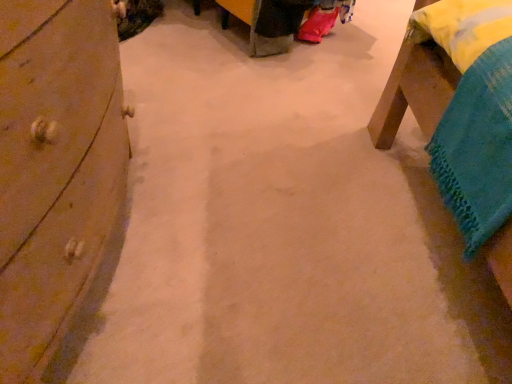
Describe the element at coordinates (413, 92) in the screenshot. I see `wooden bed frame at upper right` at that location.

I want to click on wooden bed frame at upper right, so click(x=413, y=92).

Image resolution: width=512 pixels, height=384 pixels. Describe the element at coordinates (55, 168) in the screenshot. I see `wooden dresser at left` at that location.

I want to click on wooden dresser at left, so [55, 168].

In order to face wooden dresser at left, should I rotate leftwards or rightwards?

Rotate your view left by about 32.052°.

Find the location of `wooden bed frame at upper right`. wooden bed frame at upper right is located at coordinates (413, 92).

Based on the photo, does wooden bed frame at upper right appear on the right side of wooden dresser at left?

Correct, you'll find wooden bed frame at upper right to the right of wooden dresser at left.

Relative to wooden dresser at left, is wooden bed frame at upper right in front or behind?

Visually, wooden bed frame at upper right is located behind wooden dresser at left.

Is point (433, 95) positioned in front of point (92, 172)?

No, (433, 95) is further to viewer.

From the image's perspective, is wooden bed frame at upper right over wooden dresser at left?

Indeed, from the image's perspective, wooden bed frame at upper right is shown above wooden dresser at left.

From a real-world perspective, which is physically above, wooden bed frame at upper right or wooden dresser at left?

In real-world perspective, wooden dresser at left is above.

Consider the image. Considering the sizes of objects wooden bed frame at upper right and wooden dresser at left in the image provided, who is thinner, wooden bed frame at upper right or wooden dresser at left?

With smaller width is wooden bed frame at upper right.

From their relative heights in the image, would you say wooden bed frame at upper right is taller or shorter than wooden dresser at left?

Considering their sizes, wooden bed frame at upper right has less height than wooden dresser at left.

In terms of size, does wooden bed frame at upper right appear bigger or smaller than wooden dresser at left?

Considering their sizes, wooden bed frame at upper right takes up less space than wooden dresser at left.

Choose the correct answer: Is wooden bed frame at upper right inside wooden dresser at left or outside it?

wooden bed frame at upper right is located beyond the bounds of wooden dresser at left.

Can you see wooden bed frame at upper right touching wooden dresser at left?

wooden bed frame at upper right is not next to wooden dresser at left, and they're not touching.

Is wooden bed frame at upper right turned away from wooden dresser at left?

That's not correct — wooden bed frame at upper right is not looking away from wooden dresser at left.

How different are the orientations of wooden bed frame at upper right and wooden dresser at left in degrees?

The angle between the facing direction of wooden bed frame at upper right and the facing direction of wooden dresser at left is 90.2 degrees.

How much distance is there between wooden bed frame at upper right and wooden dresser at left?

They are 36.64 inches apart.

Where is `chest of drawers in front of the wooden bed frame at upper right`? This screenshot has height=384, width=512. chest of drawers in front of the wooden bed frame at upper right is located at coordinates (55, 168).

Between wooden dresser at left and wooden bed frame at upper right, which one appears on the right side from the viewer's perspective?

Positioned to the right is wooden bed frame at upper right.

Is wooden dresser at left positioned in front of wooden bed frame at upper right?

Yes, wooden dresser at left is closer to the camera.

Which is closer, (x=35, y=223) or (x=405, y=79)?

Point (x=35, y=223) is positioned closer to the camera compared to point (x=405, y=79).

From the image's perspective, is wooden dresser at left on wooden bed frame at upper right?

No, from the image's perspective, wooden dresser at left is not above wooden bed frame at upper right.

From a real-world perspective, who is located lower, wooden dresser at left or wooden bed frame at upper right?

In real-world perspective, wooden bed frame at upper right is lower.

Between wooden dresser at left and wooden bed frame at upper right, which one has larger width?

wooden dresser at left.

Is wooden dresser at left taller or shorter than wooden bed frame at upper right?

Considering their sizes, wooden dresser at left has more height than wooden bed frame at upper right.

Is wooden dresser at left bigger than wooden bed frame at upper right?

Indeed, wooden dresser at left has a larger size compared to wooden bed frame at upper right.

Do you think wooden dresser at left is within wooden bed frame at upper right, or outside of it?

The correct answer is: outside.

Would you consider wooden dresser at left to be distant from wooden bed frame at upper right?

No, wooden dresser at left is in close proximity to wooden bed frame at upper right.

Could you tell me if wooden dresser at left is facing wooden bed frame at upper right?

Yes.

Where is `chest of drawers to the left of wooden bed frame at upper right`? This screenshot has height=384, width=512. chest of drawers to the left of wooden bed frame at upper right is located at coordinates (55, 168).

You are a GUI agent. You are given a task and a screenshot of the screen. Output one action in this format:
    pyautogui.click(x=<x>, y=<y>)
    Task: Click on the furniture behind the wooden dresser at left
    
    Given the screenshot: What is the action you would take?
    pyautogui.click(x=413, y=92)

The image size is (512, 384). In the image, there is a wooden dresser at left. Identify the location of furniture below it (from a real-world perspective). (413, 92).